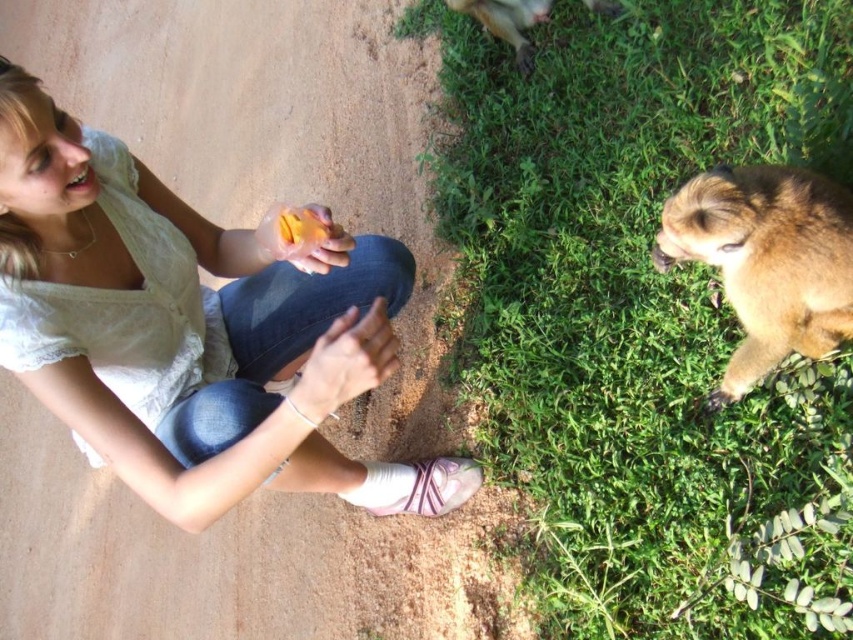
Does green grass at lower right have a lesser height compared to brown furry monkey at upper right?

No, green grass at lower right is not shorter than brown furry monkey at upper right.

Does green grass at lower right come in front of brown furry monkey at upper right?

Yes, it is in front of brown furry monkey at upper right.

Locate an element on the screen. green grass at lower right is located at coordinates (642, 308).

Is green grass at lower right taller than white lace shirt at upper left?

Indeed, green grass at lower right has a greater height compared to white lace shirt at upper left.

Who is lower down, green grass at lower right or white lace shirt at upper left?

Positioned lower is white lace shirt at upper left.

At what (x,y) coordinates should I click in order to perform the action: click on green grass at lower right. Please return your answer as a coordinate pair (x, y). The height and width of the screenshot is (640, 853). Looking at the image, I should click on (642, 308).

From the picture: Between green grass at lower right and brown furry dog at lower right, which one has less height?

Standing shorter between the two is brown furry dog at lower right.

Can you confirm if green grass at lower right is shorter than brown furry dog at lower right?

In fact, green grass at lower right may be taller than brown furry dog at lower right.

This screenshot has height=640, width=853. Describe the element at coordinates (642, 308) in the screenshot. I see `green grass at lower right` at that location.

Find the location of a particular element. This screenshot has height=640, width=853. green grass at lower right is located at coordinates (642, 308).